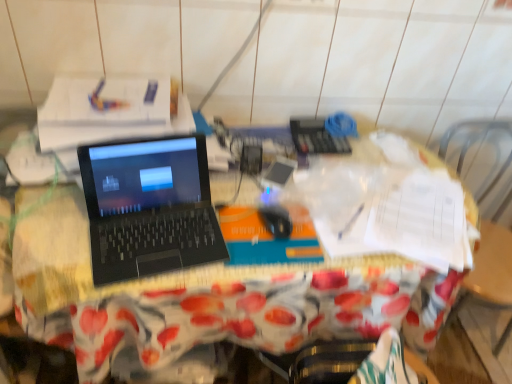
Question: From a real-world perspective, is black matte laptop at center positioned above or below black matte mouse at center?

Choices:
 (A) above
 (B) below

Answer: (A)

Question: In the image, is black matte laptop at center positioned in front of or behind black matte mouse at center?

Choices:
 (A) front
 (B) behind

Answer: (A)

Question: Estimate the real-world distances between objects in this image. Which object is farther from the black matte mouse at center?

Choices:
 (A) black matte laptop at center
 (B) black plastic laptop at center

Answer: (B)

Question: Estimate the real-world distances between objects in this image. Which object is closer to the black matte laptop at center?

Choices:
 (A) black matte mouse at center
 (B) black plastic laptop at center

Answer: (B)